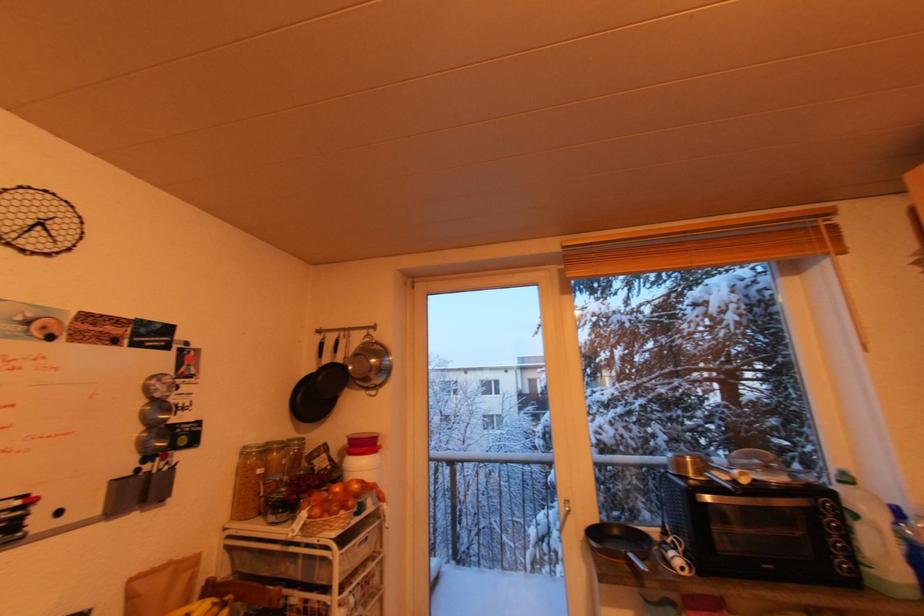
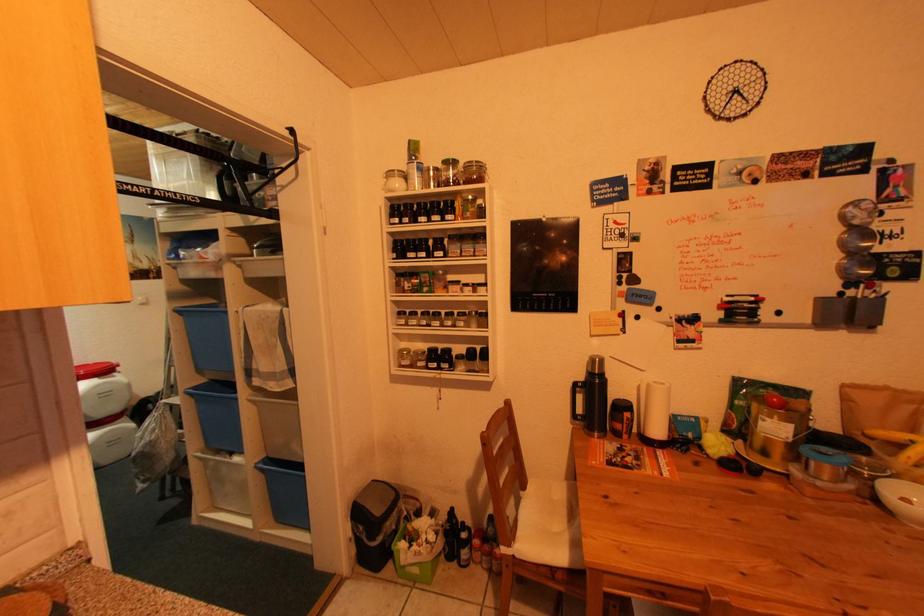
Question: The camera is either moving clockwise (left) or counter-clockwise (right) around the object. The first image is from the beginning of the video and the second image is from the end. Is the camera moving left or right when shooting the video?

Choices:
 (A) Left
 (B) Right

Answer: (B)